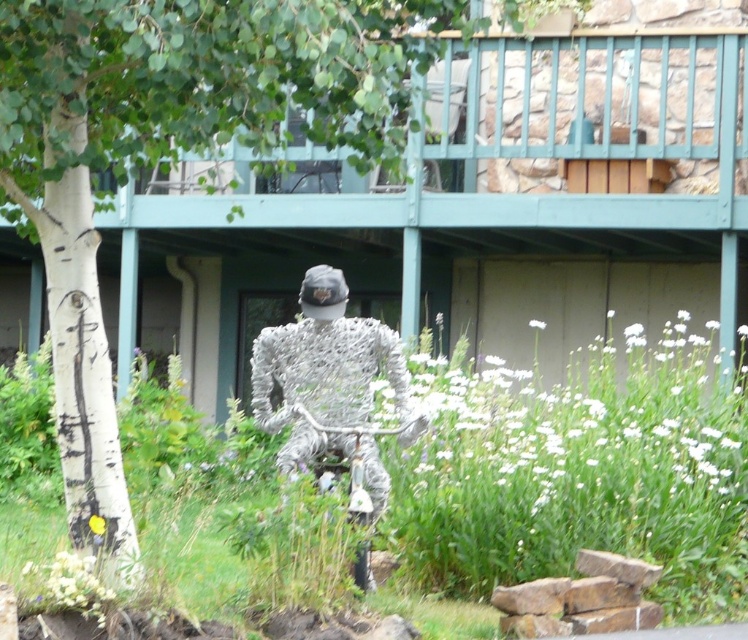
Is white bark tree at center smaller than silver wire sculpture at center?

Yes.

From the picture: Can you confirm if white bark tree at center is bigger than silver wire sculpture at center?

No, white bark tree at center is not bigger than silver wire sculpture at center.

You are a GUI agent. You are given a task and a screenshot of the screen. Output one action in this format:
    pyautogui.click(x=<x>, y=<y>)
    Task: Click on the white bark tree at center
    The height and width of the screenshot is (640, 748).
    Given the screenshot: What is the action you would take?
    pyautogui.click(x=174, y=154)

Find the location of `white bark tree at center`. white bark tree at center is located at coordinates (174, 154).